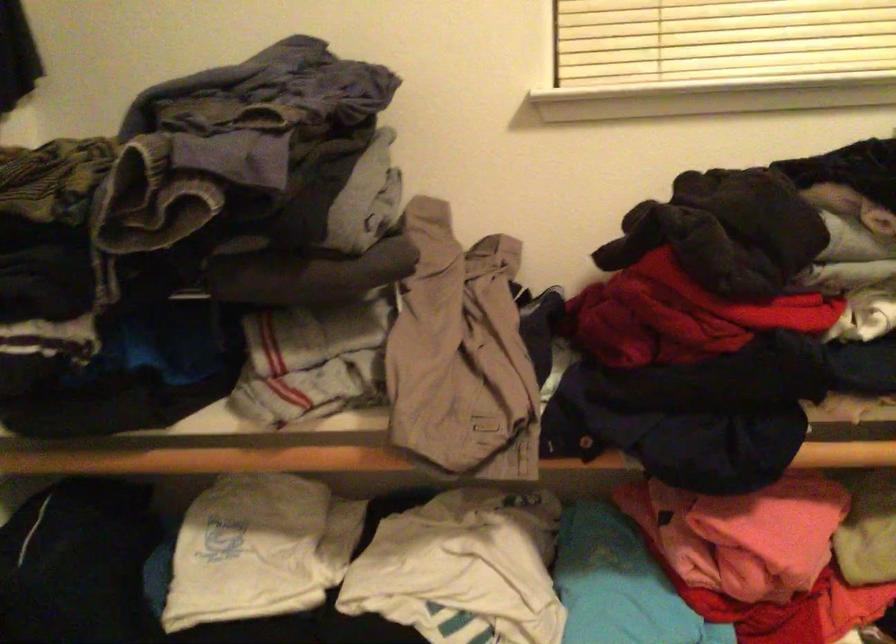
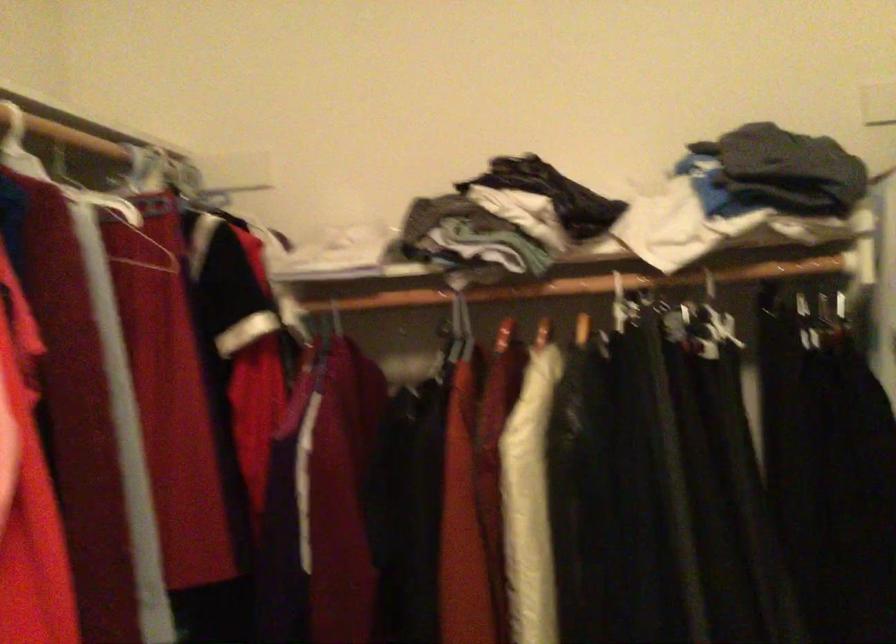
Question: The camera is either moving clockwise (left) or counter-clockwise (right) around the object. The first image is from the beginning of the video and the second image is from the end. Is the camera moving left or right when shooting the video?

Choices:
 (A) Left
 (B) Right

Answer: (A)